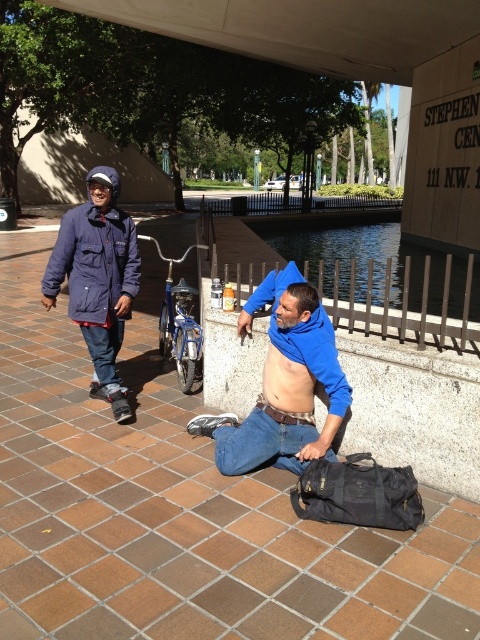
Based on the photo, does navy blue jacket at left come behind muscle at center?

Yes, navy blue jacket at left is further from the viewer.

Is navy blue jacket at left taller than muscle at center?

Yes, navy blue jacket at left is taller than muscle at center.

Which is behind, point (66, 214) or point (291, 376)?

Positioned behind is point (66, 214).

Locate an element on the screen. navy blue jacket at left is located at coordinates (97, 280).

Does point (86, 237) come closer to viewer compared to point (330, 337)?

That is False.

Does navy blue jacket at left have a smaller size compared to blue cotton jacket at center?

No, navy blue jacket at left is not smaller than blue cotton jacket at center.

Is point (134, 262) positioned in front of point (257, 292)?

That is False.

You are a GUI agent. You are given a task and a screenshot of the screen. Output one action in this format:
    pyautogui.click(x=<x>, y=<y>)
    Task: Click on the navy blue jacket at left
    This screenshot has height=640, width=480.
    Given the screenshot: What is the action you would take?
    pyautogui.click(x=97, y=280)

Which is behind, point (33, 547) or point (241, 328)?

Positioned behind is point (241, 328).

Is point (349, 582) closer to camera compared to point (311, 444)?

Yes.

Where is `brown tile pavement at center`? Image resolution: width=480 pixels, height=640 pixels. brown tile pavement at center is located at coordinates (182, 513).